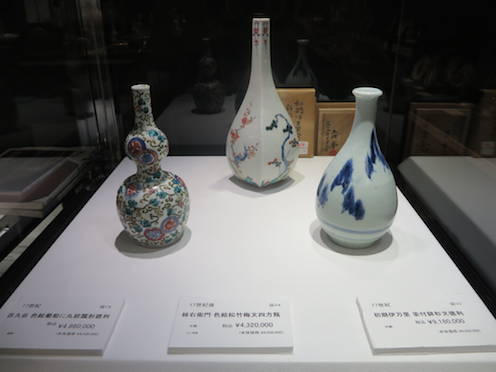
Find the location of a particular element. The image size is (496, 372). vase is located at coordinates (167, 197), (264, 128), (372, 214).